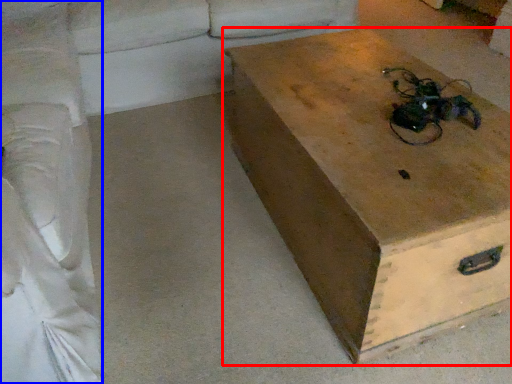
Question: Which of the following is the closest to the observer, box (highlighted by a red box) or couch (highlighted by a blue box)?

Choices:
 (A) box
 (B) couch

Answer: (B)